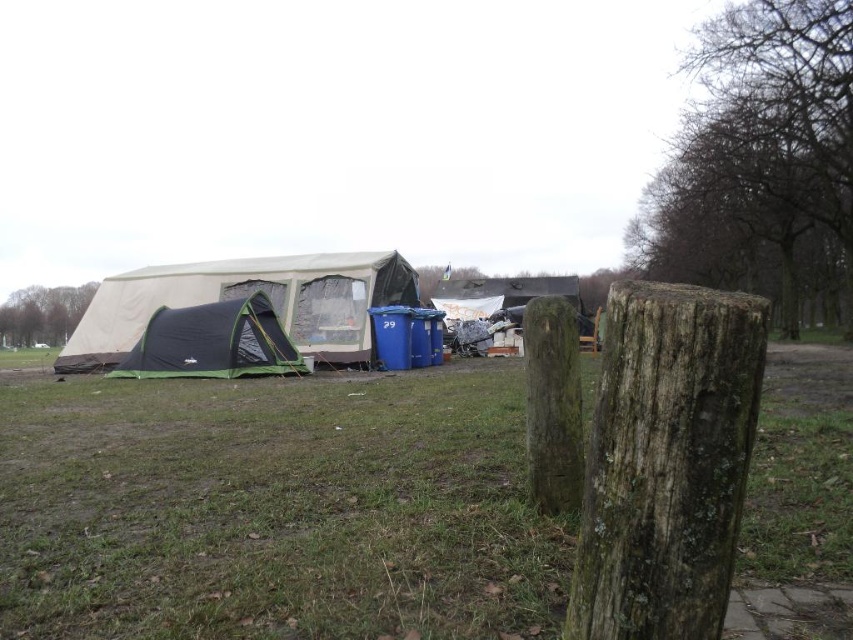
You are a hiker who wants to take a photo of the weathered wood post at center from the point at coordinate (666, 461). Is the post visible from that point?

The weathered wood post at center is located exactly at the point (666, 461), so you are standing right at the post. Therefore, you can clearly see the post from that point.